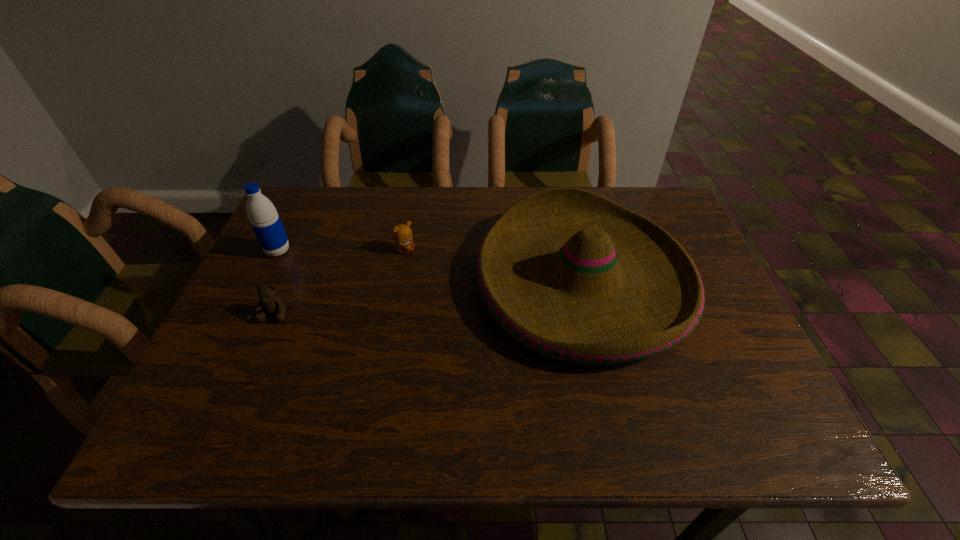
You are a GUI agent. You are given a task and a screenshot of the screen. Output one action in this format:
    pyautogui.click(x=<x>, y=<y>)
    Task: Click on the free space between the water bottle and the nearer teddy bear
    
    Given the screenshot: What is the action you would take?
    pyautogui.click(x=276, y=282)

This screenshot has width=960, height=540. I want to click on free space between the farther teddy bear and the nearer teddy bear, so click(340, 282).

The image size is (960, 540). I want to click on vacant area that lies between the tallest object and the third object from left to right, so click(341, 251).

Locate an element on the screen. free space between the nearer teddy bear and the tallest object is located at coordinates (276, 282).

You are a GUI agent. You are given a task and a screenshot of the screen. Output one action in this format:
    pyautogui.click(x=<x>, y=<y>)
    Task: Click on the vacant area that lies between the rightmost object and the water bottle
    The image size is (960, 540).
    Given the screenshot: What is the action you would take?
    coord(430,266)

Find the location of a particular element. This screenshot has width=960, height=540. vacant space that is in between the rightmost object and the water bottle is located at coordinates (430, 266).

Where is `free spot between the water bottle and the third object from left to right`? free spot between the water bottle and the third object from left to right is located at coordinates (341, 251).

The height and width of the screenshot is (540, 960). I want to click on unoccupied position between the sombrero and the left teddy bear, so click(x=428, y=298).

Identify the location of the closest object to the third shortest object. Image resolution: width=960 pixels, height=540 pixels. (401, 234).

Locate an element on the screen. the third closest object to the right teddy bear is located at coordinates (265, 221).